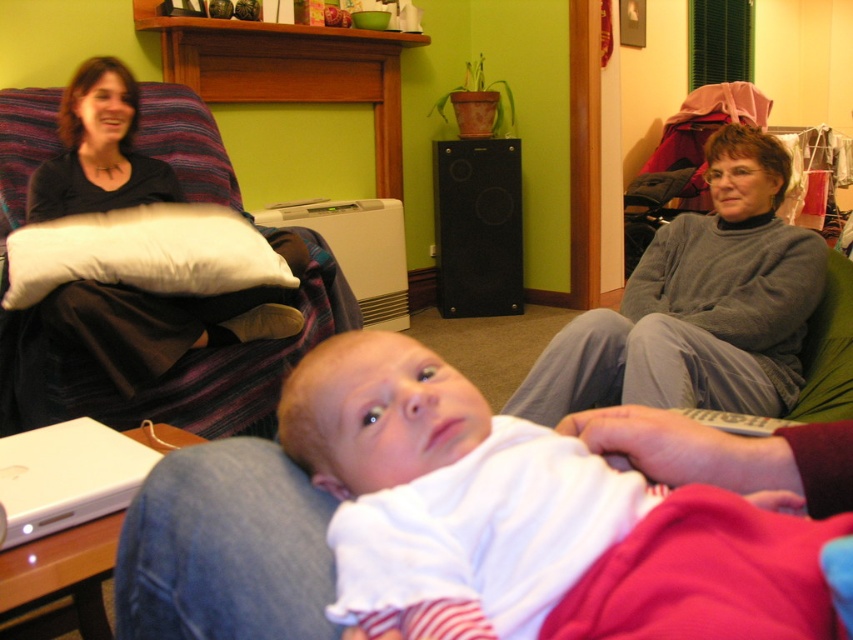
Question: Is white soft pillow at upper left further to the viewer compared to white matte laptop at lower left?

Choices:
 (A) no
 (B) yes

Answer: (B)

Question: Which point is closer to the camera?

Choices:
 (A) gray sweater at right
 (B) matte black shirt at left
 (C) white soft fabric baby at center

Answer: (C)

Question: Which of the following is the closest to the observer?

Choices:
 (A) white soft pillow at upper left
 (B) white matte laptop at lower left
 (C) matte black shirt at left
 (D) gray sweater at right

Answer: (B)

Question: Does gray sweater at right have a smaller size compared to matte black shirt at left?

Choices:
 (A) no
 (B) yes

Answer: (A)

Question: Does white soft fabric baby at center appear over white matte laptop at lower left?

Choices:
 (A) yes
 (B) no

Answer: (A)

Question: Which of these objects is positioned farthest from the white soft fabric baby at center?

Choices:
 (A) white matte laptop at lower left
 (B) gray sweater at right

Answer: (B)